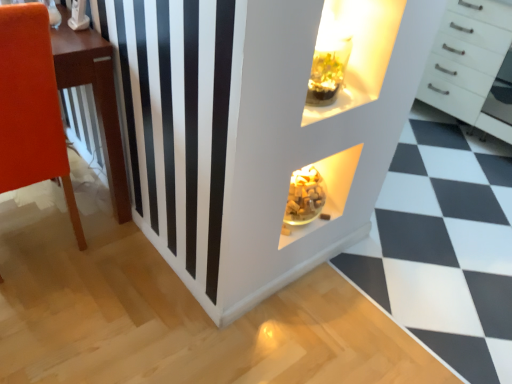
Find the location of a particular element. This screenshot has width=512, height=384. free space to the right of matte orange chair at left is located at coordinates 125,279.